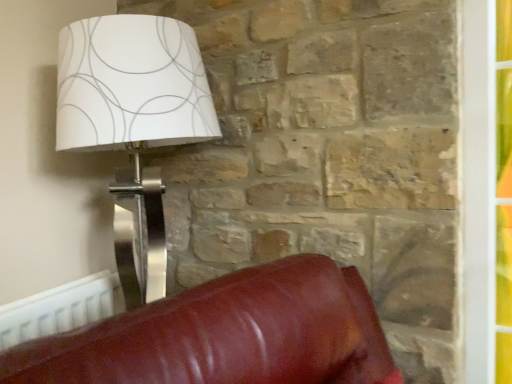
Question: From a real-world perspective, is white paper lampshade at upper left above or below white plastic radiator at lower left?

Choices:
 (A) below
 (B) above

Answer: (B)

Question: Choose the correct answer: Is white paper lampshade at upper left inside white plastic radiator at lower left or outside it?

Choices:
 (A) inside
 (B) outside

Answer: (B)

Question: In terms of width, does white paper lampshade at upper left look wider or thinner when compared to white plastic radiator at lower left?

Choices:
 (A) wide
 (B) thin

Answer: (A)

Question: Is white plastic radiator at lower left wider or thinner than white paper lampshade at upper left?

Choices:
 (A) wide
 (B) thin

Answer: (B)

Question: From the image's perspective, relative to white paper lampshade at upper left, is white plastic radiator at lower left above or below?

Choices:
 (A) above
 (B) below

Answer: (B)

Question: From a real-world perspective, is white plastic radiator at lower left physically located above or below white paper lampshade at upper left?

Choices:
 (A) above
 (B) below

Answer: (B)

Question: In the image, is white plastic radiator at lower left positioned in front of or behind white paper lampshade at upper left?

Choices:
 (A) front
 (B) behind

Answer: (B)